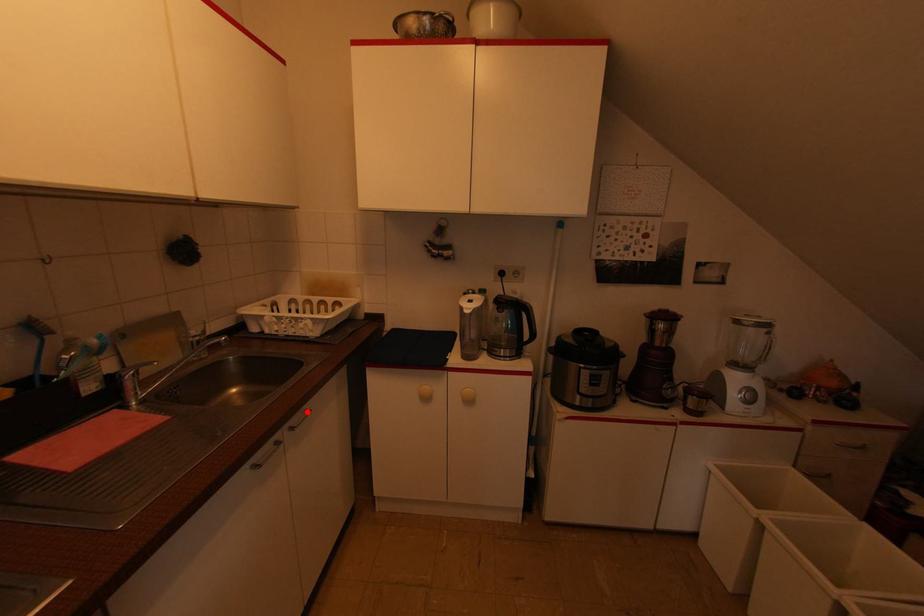
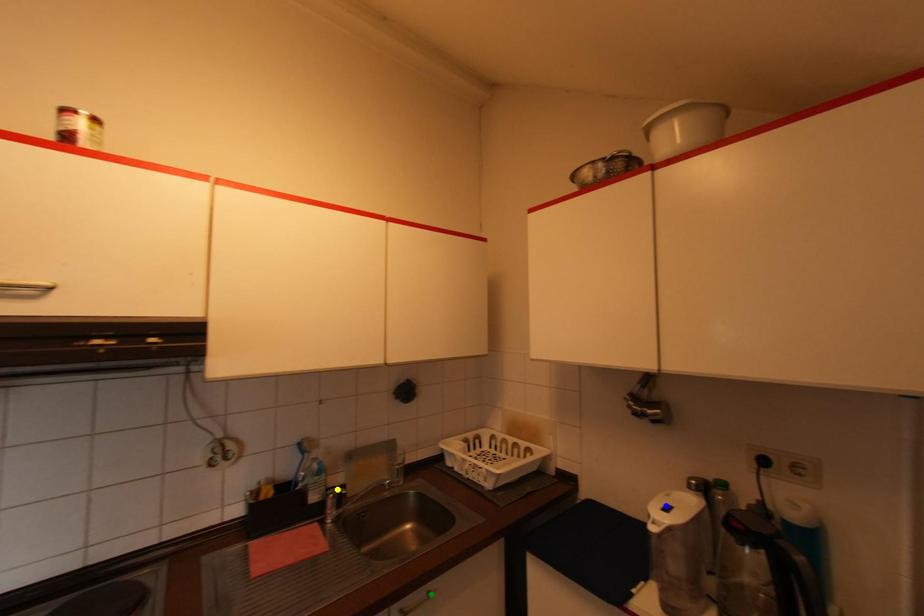
Question: I am providing you with two images of the same scene from different viewpoints. A red point is marked on the first image. You are given multiple points on the second image. Can you choose the point in image 2 that corresponds to the point in image 1?

Choices:
 (A) green point
 (B) blue point
 (C) yellow point

Answer: (A)